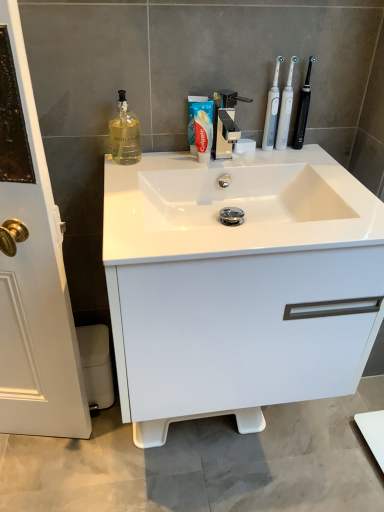
Find the location of a particular element. Image resolution: width=384 pixels, height=512 pixels. free space in front of black plastic toothbrush at upper right, positioned as the first toothbrush in right-to-left order is located at coordinates pyautogui.click(x=309, y=167).